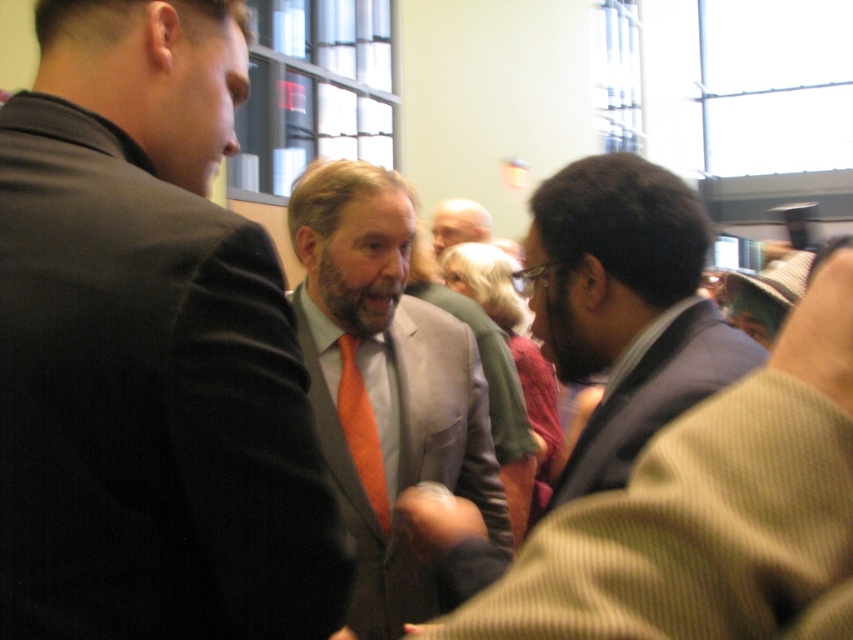
Based on the photo, you are a photographer standing in the room. You want to take a closeup photo of the matte gray suit at center without including any people in the background. The camera you are using has a maximum focus range of 5 feet. Can you take the photo from your current position?

The matte gray suit at center is 5.25 feet away from the camera. Since the camera can only focus up to 5 feet, you cannot take the photo from your current position because the distance is beyond the focus range.

Based on the photo, you are a photographer at the event and need to capture a photo that includes both the matte gray suit at center and dark brown suit at center. The camera you are using has a minimum focus distance of 27 inches. Will you be able to take the photo without moving either of the subjects?

The matte gray suit at center and dark brown suit at center are 26.99 inches apart, which is just under the camera minimum focus distance of 27 inches. Therefore, you will not be able to capture both subjects in focus without moving them closer together.

You are planning to take a photo of the dark brown suit at center and the orange satin tie at center for a fashion magazine. Which of the two items is bigger in size?

The dark brown suit at center is larger in size compared to the orange satin tie at center.